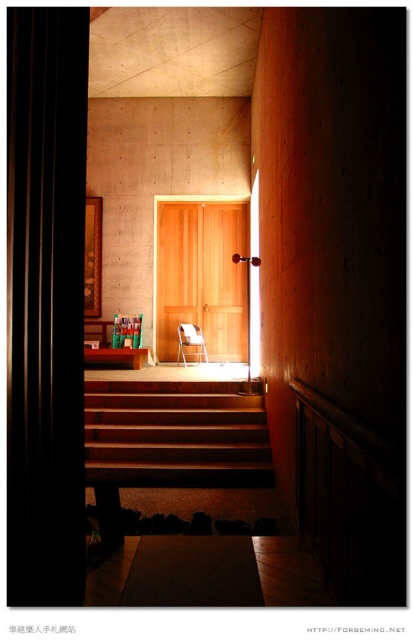
Question: Does wooden stairs at center have a lesser width compared to wooden at center?

Choices:
 (A) no
 (B) yes

Answer: (A)

Question: Is black matte curtain at left below wooden at center?

Choices:
 (A) yes
 (B) no

Answer: (B)

Question: Which point appears closest to the camera in this image?

Choices:
 (A) [203, 280]
 (B) [106, 358]
 (C) [50, 90]
 (D) [147, 486]

Answer: (C)

Question: Which of the following is the closest to the observer?

Choices:
 (A) (61, 129)
 (B) (170, 353)
 (C) (154, 483)
 (D) (203, 342)

Answer: (A)

Question: Among these objects, which one is nearest to the camera?

Choices:
 (A) matte wood chair at center
 (B) wooden door at center

Answer: (A)

Question: Can you confirm if black matte curtain at left is smaller than wooden at center?

Choices:
 (A) yes
 (B) no

Answer: (A)